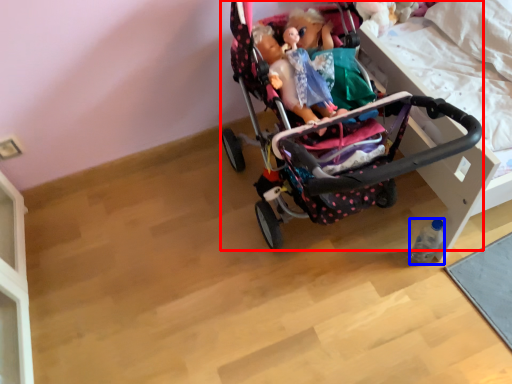
Question: Which object appears farthest to the camera in this image, stroller (highlighted by a red box) or bottle (highlighted by a blue box)?

Choices:
 (A) stroller
 (B) bottle

Answer: (B)